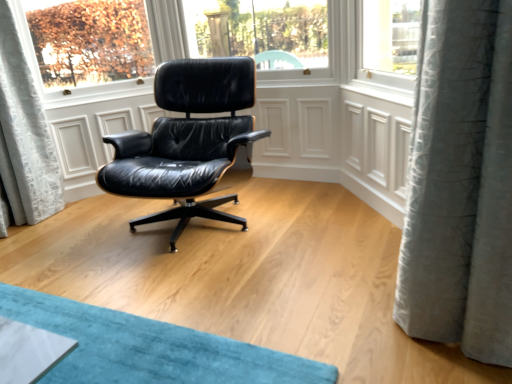
You are a GUI agent. You are given a task and a screenshot of the screen. Output one action in this format:
    pyautogui.click(x=<x>, y=<y>)
    Task: Click on the black leather chair at center
    
    Given the screenshot: What is the action you would take?
    pyautogui.click(x=186, y=140)

The image size is (512, 384). Describe the element at coordinates (186, 140) in the screenshot. I see `black leather chair at center` at that location.

Measure the distance between point (x=247, y=144) and camera.

They are 7.98 feet apart.

The height and width of the screenshot is (384, 512). Find the location of `gray textured curtain at right`. gray textured curtain at right is located at coordinates (462, 185).

The width and height of the screenshot is (512, 384). What do you see at coordinates (462, 185) in the screenshot?
I see `gray textured curtain at right` at bounding box center [462, 185].

Locate an element on the screen. The image size is (512, 384). black leather chair at center is located at coordinates (186, 140).

Which is more to the right, gray textured curtain at right or black leather chair at center?

gray textured curtain at right is more to the right.

Consider the image. Which is behind, gray textured curtain at right or black leather chair at center?

black leather chair at center.

Which is closer, (506, 175) or (183, 145)?

Point (506, 175) is closer to the camera than point (183, 145).

From the image's perspective, which one is positioned lower, gray textured curtain at right or black leather chair at center?

gray textured curtain at right.

From a real-world perspective, which object rests below the other?

From a 3D spatial view, black leather chair at center is below.

In terms of width, does gray textured curtain at right look wider or thinner when compared to black leather chair at center?

Considering their sizes, gray textured curtain at right looks slimmer than black leather chair at center.

Considering the relative sizes of gray textured curtain at right and black leather chair at center in the image provided, is gray textured curtain at right taller than black leather chair at center?

Yes.

Does gray textured curtain at right have a smaller size compared to black leather chair at center?

Correct, gray textured curtain at right occupies less space than black leather chair at center.

Which is correct: gray textured curtain at right is inside black leather chair at center, or outside of it?

gray textured curtain at right exists outside the volume of black leather chair at center.

Is gray textured curtain at right with black leather chair at center?

gray textured curtain at right and black leather chair at center are not in contact.

Is gray textured curtain at right facing towards black leather chair at center?

No, gray textured curtain at right is not turned towards black leather chair at center.

How far apart are gray textured curtain at right and black leather chair at center?

gray textured curtain at right and black leather chair at center are 1.25 meters apart.

This screenshot has height=384, width=512. Find the location of `curtain above the black leather chair at center (from a real-world perspective)`. curtain above the black leather chair at center (from a real-world perspective) is located at coordinates (462, 185).

Does black leather chair at center appear on the left side of gray textured curtain at right?

Yes, black leather chair at center is to the left of gray textured curtain at right.

From the picture: Does black leather chair at center come behind gray textured curtain at right?

Yes, black leather chair at center is further from the viewer.

Does point (207, 206) come behind point (449, 240)?

That is True.

From the image's perspective, does black leather chair at center appear lower than gray textured curtain at right?

Incorrect, from the image's perspective, black leather chair at center is higher than gray textured curtain at right.

From a real-world perspective, is black leather chair at center below gray textured curtain at right?

Correct, in the physical world, black leather chair at center is lower than gray textured curtain at right.

Does black leather chair at center have a lesser width compared to gray textured curtain at right?

In fact, black leather chair at center might be wider than gray textured curtain at right.

Who is shorter, black leather chair at center or gray textured curtain at right?

Standing shorter between the two is black leather chair at center.

Does black leather chair at center have a smaller size compared to gray textured curtain at right?

No.

From the picture: Choose the correct answer: Is black leather chair at center inside gray textured curtain at right or outside it?

The correct answer is: outside.

Is black leather chair at center in contact with gray textured curtain at right?

black leather chair at center and gray textured curtain at right are clearly separated.

Is black leather chair at center oriented away from gray textured curtain at right?

No, black leather chair at center is not facing away from gray textured curtain at right.

How different are the orientations of black leather chair at center and gray textured curtain at right in degrees?

The angle between the facing direction of black leather chair at center and the facing direction of gray textured curtain at right is 64.5 degrees.

Identify the location of chair on the left of the gray textured curtain at right. (186, 140).

Where is `chair on the left of gray textured curtain at right`? This screenshot has height=384, width=512. chair on the left of gray textured curtain at right is located at coordinates (186, 140).

Identify the location of curtain below the black leather chair at center (from the image's perspective). (462, 185).